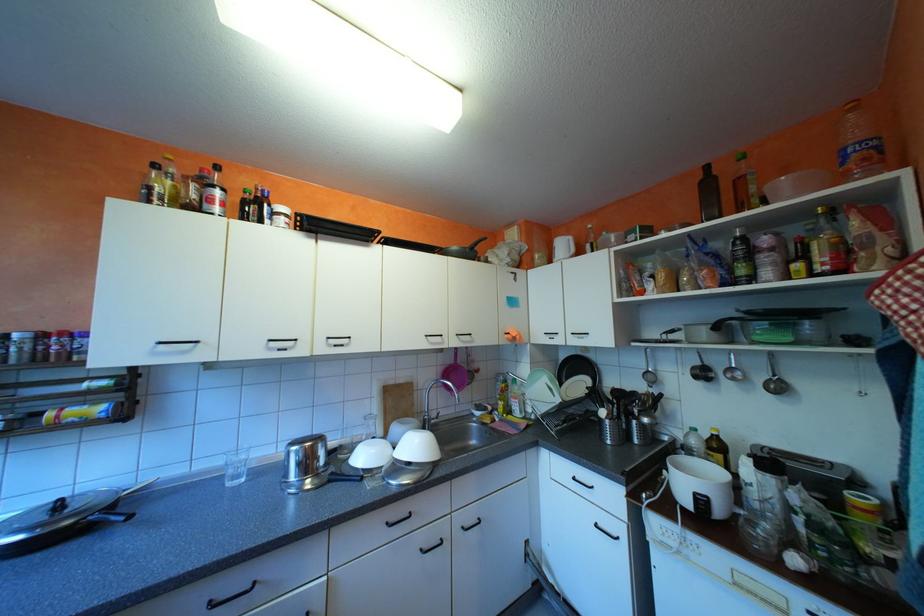
Which object does [709,193] point to?

This point indicates the dark glass bottle.